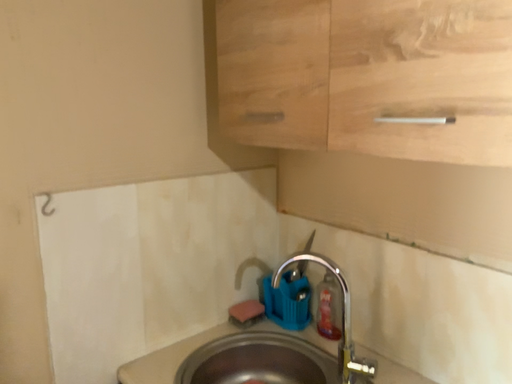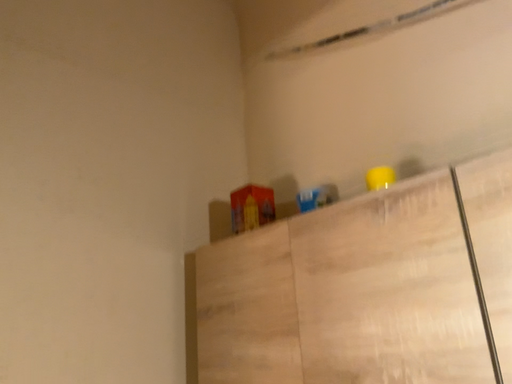
Question: Which way did the camera rotate in the video?

Choices:
 (A) rotated upward
 (B) rotated downward

Answer: (A)